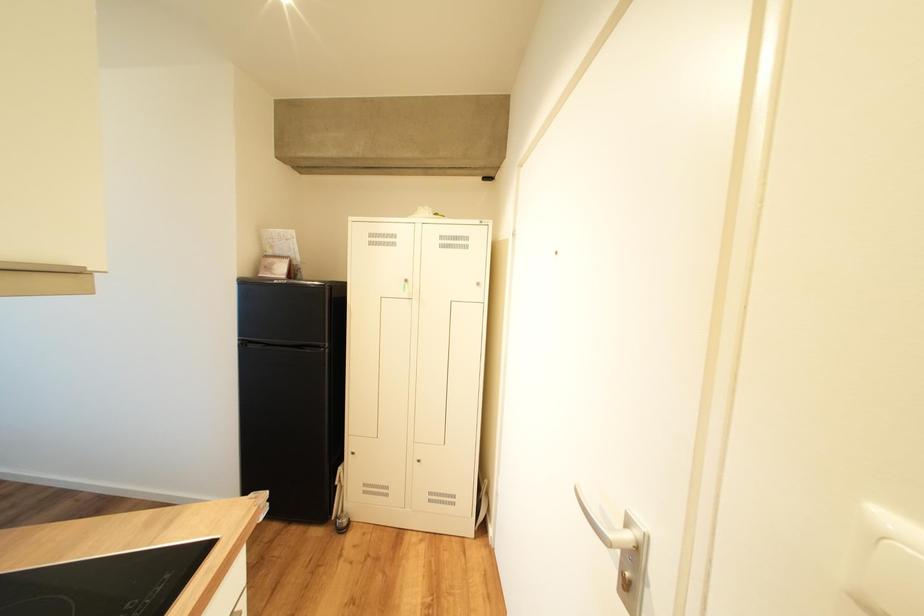
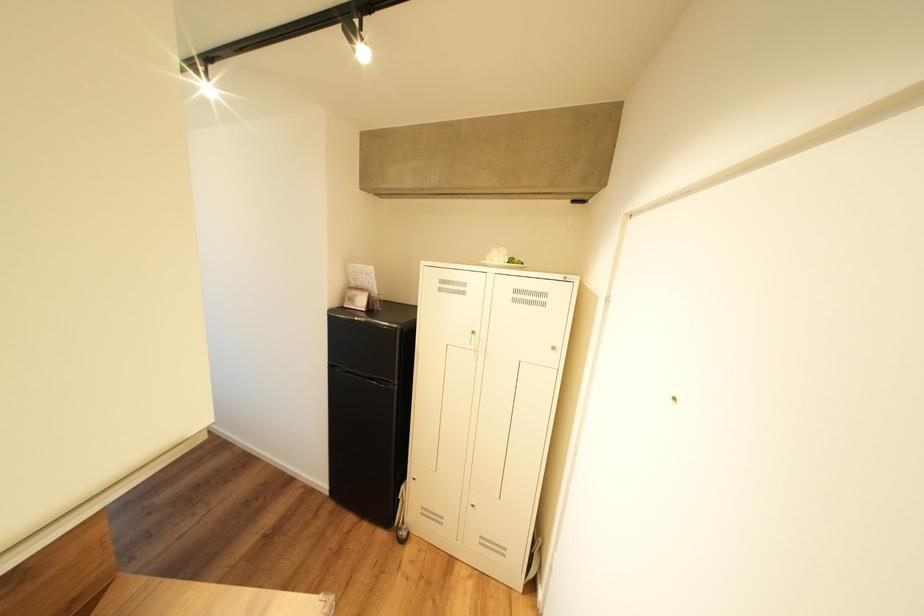
Question: How did the camera likely rotate?

Choices:
 (A) Left
 (B) Right
 (C) Up
 (D) Down

Answer: (A)